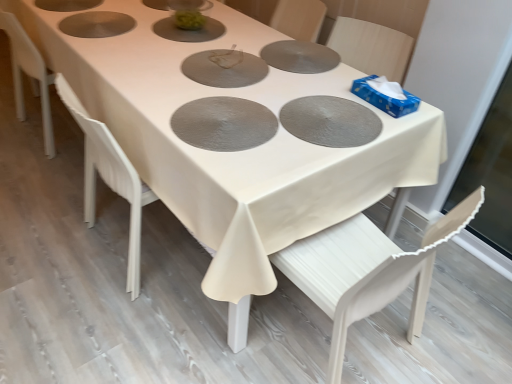
Question: From a real-world perspective, is matte gray pizza pan at center, which is the 2th pizza pan from top to bottom, positioned under white wood chair at lower right based on gravity?

Choices:
 (A) yes
 (B) no

Answer: (B)

Question: Is matte gray pizza pan at center, which is the second pizza pan in bottom-to-top order, positioned beyond the bounds of white wood chair at lower right?

Choices:
 (A) yes
 (B) no

Answer: (B)

Question: Could white wood chair at lower right be considered to be inside matte gray pizza pan at center, which is the second pizza pan in bottom-to-top order?

Choices:
 (A) no
 (B) yes

Answer: (A)

Question: Does matte gray pizza pan at center, which is the 2th pizza pan from top to bottom, have a greater height compared to white wood chair at lower right?

Choices:
 (A) yes
 (B) no

Answer: (B)

Question: Is matte gray pizza pan at center, which is the 2th pizza pan from top to bottom, looking in the opposite direction of white wood chair at lower right?

Choices:
 (A) no
 (B) yes

Answer: (A)

Question: Considering the relative sizes of matte gray pizza pan at center, which is the second pizza pan in bottom-to-top order, and white wood chair at lower right in the image provided, is matte gray pizza pan at center, which is the second pizza pan in bottom-to-top order, smaller than white wood chair at lower right?

Choices:
 (A) yes
 (B) no

Answer: (A)

Question: Is textured silver pizza pan at center, which is counted as the third pizza pan, starting from the top, surrounding matte gray pizza pan at center, which ranks as the third pizza pan in bottom-to-top order?

Choices:
 (A) yes
 (B) no

Answer: (B)

Question: Is matte gray pizza pan at center, which ranks as the 1th pizza pan in top-to-bottom order, at the back of textured silver pizza pan at center, which is counted as the third pizza pan, starting from the top?

Choices:
 (A) yes
 (B) no

Answer: (B)

Question: Does textured silver pizza pan at center, arranged as the first pizza pan when ordered from the bottom, come behind matte gray pizza pan at center, which ranks as the 1th pizza pan in top-to-bottom order?

Choices:
 (A) yes
 (B) no

Answer: (B)

Question: Are textured silver pizza pan at center, which is counted as the third pizza pan, starting from the top, and matte gray pizza pan at center, which ranks as the third pizza pan in bottom-to-top order, beside each other?

Choices:
 (A) no
 (B) yes

Answer: (A)

Question: From a real-world perspective, is textured silver pizza pan at center, which is counted as the third pizza pan, starting from the top, physically above matte gray pizza pan at center, which ranks as the third pizza pan in bottom-to-top order?

Choices:
 (A) no
 (B) yes

Answer: (B)

Question: Is textured silver pizza pan at center, which is counted as the third pizza pan, starting from the top, positioned beyond the bounds of matte gray pizza pan at center, which ranks as the 1th pizza pan in top-to-bottom order?

Choices:
 (A) no
 (B) yes

Answer: (B)

Question: Can you confirm if white wood chair at lower right is smaller than matte gray pizza pan at center, which ranks as the 1th pizza pan in top-to-bottom order?

Choices:
 (A) no
 (B) yes

Answer: (A)